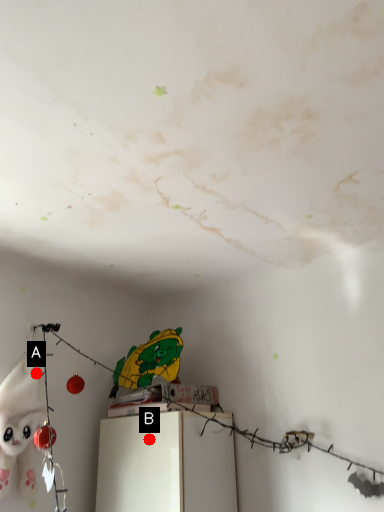
Question: Two points are circled on the image, labeled by A and B beside each circle. Which point appears farthest from the camera in this image?

Choices:
 (A) A is further
 (B) B is further

Answer: (A)